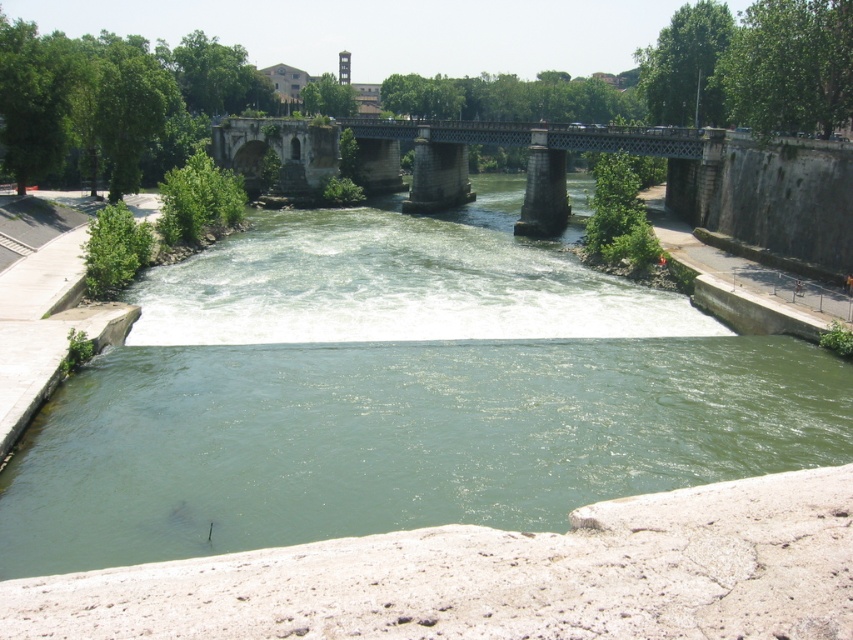
Question: Which point is closer to the camera taking this photo?

Choices:
 (A) 335,262
 (B) 312,163

Answer: (A)

Question: Considering the relative positions of green concrete river at center and stone bridge at center in the image provided, where is green concrete river at center located with respect to stone bridge at center?

Choices:
 (A) above
 (B) below

Answer: (B)

Question: Is green concrete river at center in front of stone bridge at center?

Choices:
 (A) yes
 (B) no

Answer: (A)

Question: Which object is closer to the camera taking this photo?

Choices:
 (A) green concrete river at center
 (B) stone bridge at center

Answer: (A)

Question: Is green concrete river at center thinner than stone bridge at center?

Choices:
 (A) no
 (B) yes

Answer: (B)

Question: Which point is closer to the camera taking this photo?

Choices:
 (A) (107, 406)
 (B) (396, 129)

Answer: (A)